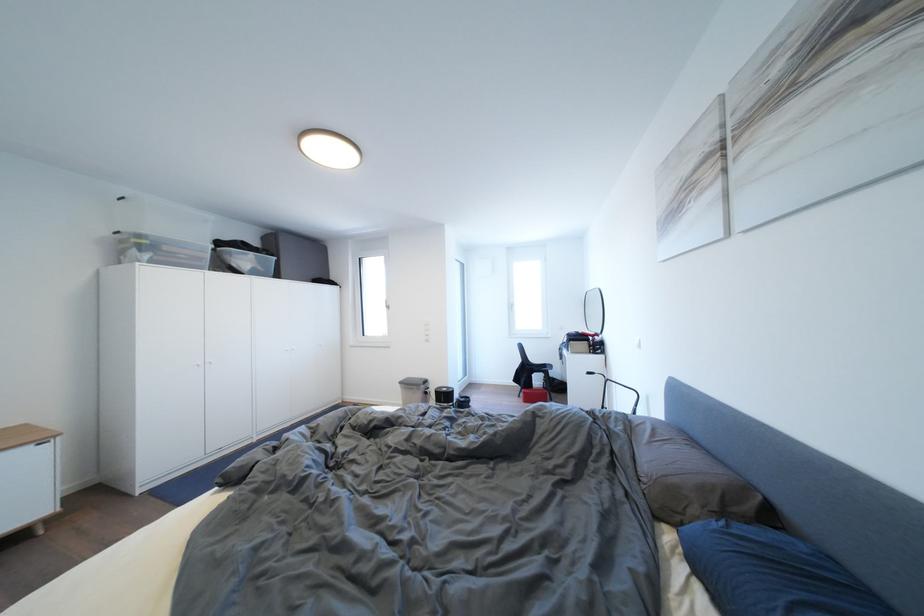
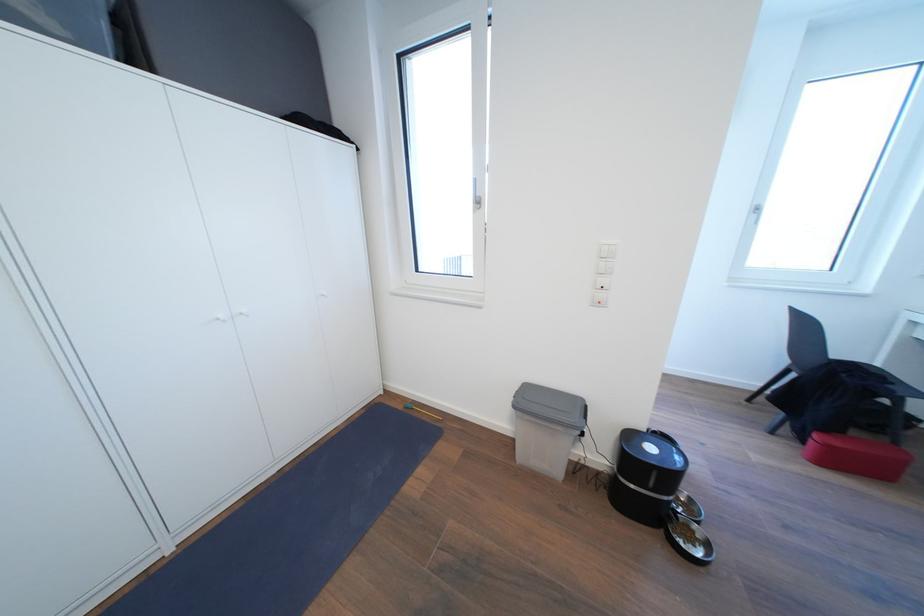
In a continuous first-person perspective shot, in which direction is the camera moving?

The cameraman moved toward left, forward.